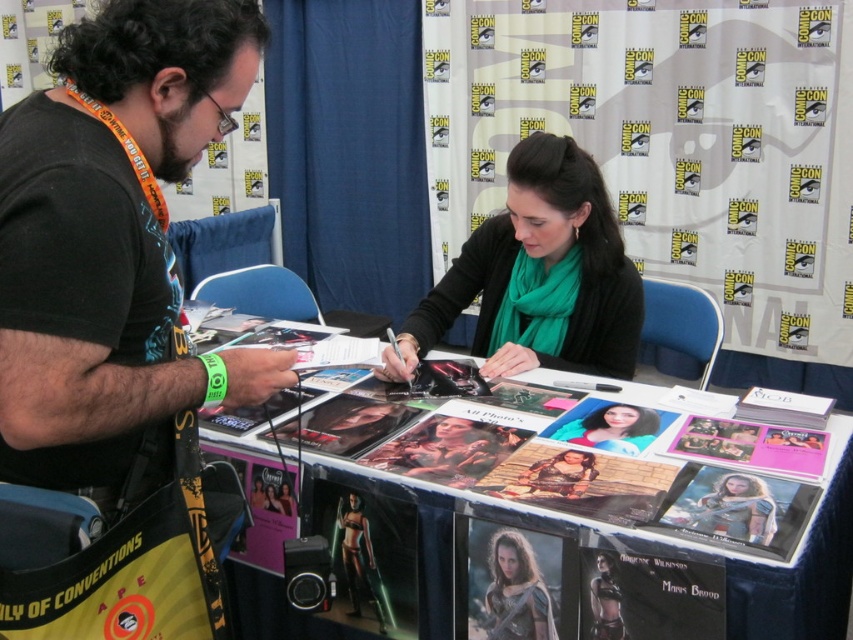
Describe the element at coordinates (113, 241) in the screenshot. I see `black matte t-shirt at left` at that location.

From the picture: Does black matte t-shirt at left appear on the right side of smooth skin portrait at center?

No, black matte t-shirt at left is not to the right of smooth skin portrait at center.

You are a GUI agent. You are given a task and a screenshot of the screen. Output one action in this format:
    pyautogui.click(x=<x>, y=<y>)
    Task: Click on the black matte t-shirt at left
    Image resolution: width=853 pixels, height=640 pixels.
    Given the screenshot: What is the action you would take?
    pyautogui.click(x=113, y=241)

Does black matte scarf at center appear on the right side of metallic armor at center?

Correct, you'll find black matte scarf at center to the right of metallic armor at center.

Is black matte scarf at center below metallic armor at center?

No.

Does point (535, 192) lie in front of point (492, 592)?

No, it is not.

Identify the location of black matte scarf at center. (538, 275).

Which is above, black matte t-shirt at left or metallic armor at center?

Positioned higher is black matte t-shirt at left.

Is point (0, 332) closer to camera compared to point (506, 544)?

Yes, point (0, 332) is in front of point (506, 544).

Find the location of `black matte t-shirt at left`. black matte t-shirt at left is located at coordinates (113, 241).